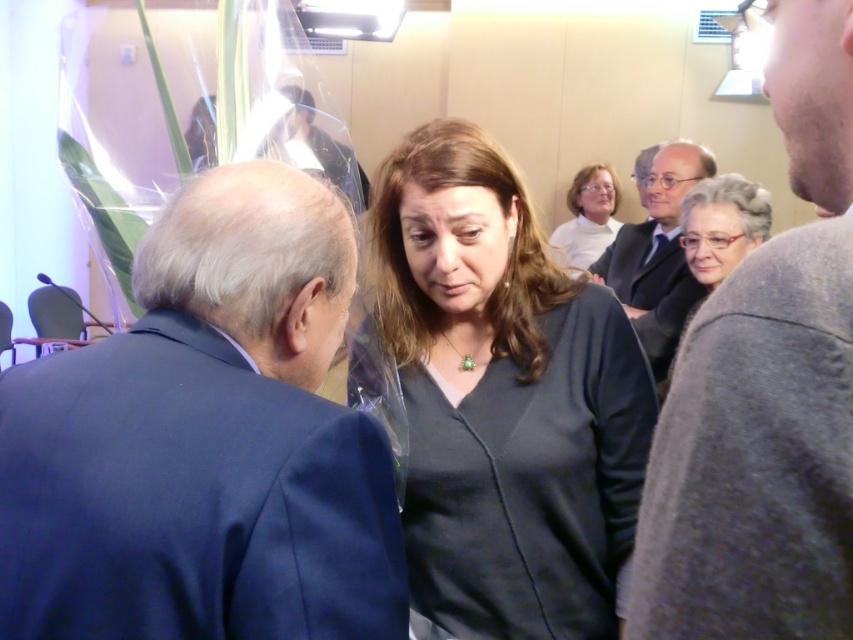
Question: Which point is farther from the camera taking this photo?

Choices:
 (A) (598, 211)
 (B) (709, 632)
 (C) (492, 508)

Answer: (A)

Question: Estimate the real-world distances between objects in this image. Which object is closer to the dark gray suit at upper right?

Choices:
 (A) white matte shirt at upper center
 (B) gray woolen sweater at upper right
 (C) matte black shirt at center
 (D) gray woolen coat at right

Answer: (D)

Question: Is dark blue suit at left below dark gray suit at upper right?

Choices:
 (A) no
 (B) yes

Answer: (B)

Question: Is dark blue suit at left bigger than gray woolen sweater at upper right?

Choices:
 (A) no
 (B) yes

Answer: (B)

Question: Estimate the real-world distances between objects in this image. Which object is closer to the dark gray suit at upper right?

Choices:
 (A) gray woolen sweater at upper right
 (B) dark blue suit at left

Answer: (B)

Question: Is matte black shirt at center to the left of gray woolen sweater at upper right from the viewer's perspective?

Choices:
 (A) no
 (B) yes

Answer: (B)